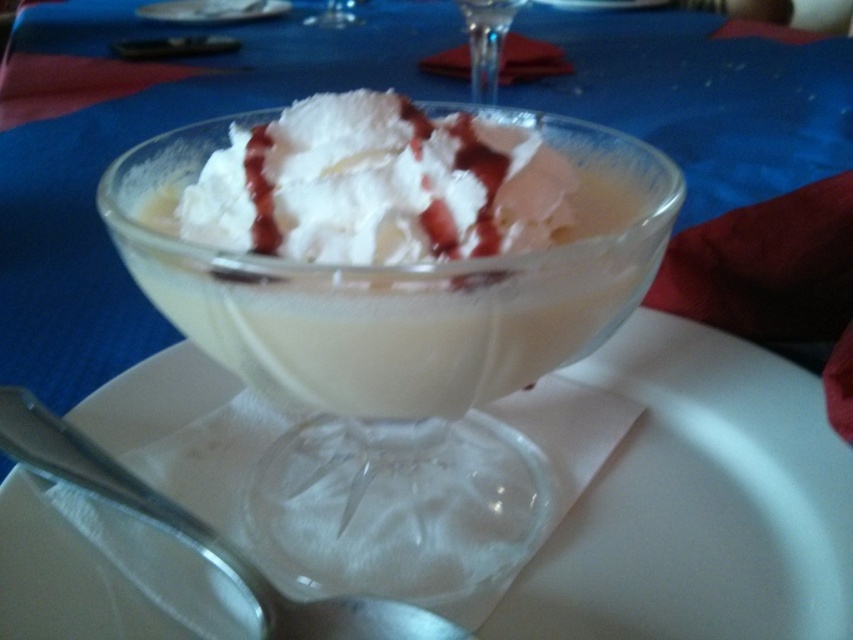
You are setting up a table for a dessert tasting event. You have a transparent glass at center and a silver metallic spoon at lower left. Which item should you place closer to the dessert bowl to ensure proper utensil placement according to standard dining etiquette?

The silver metallic spoon at lower left should be placed closer to the dessert bowl because it is smaller than the transparent glass at center, and utensils are typically positioned nearer to the plate for easy access.

You are setting the table for a dessert. The silver metallic spoon at lower left needs to be placed closer to the glass bowl. Can you move it to the center of the plate?

The silver metallic spoon at lower left is located at point [120,492], so moving it to the center of the plate would require adjusting its position from its current coordinates to the central area of the plate.